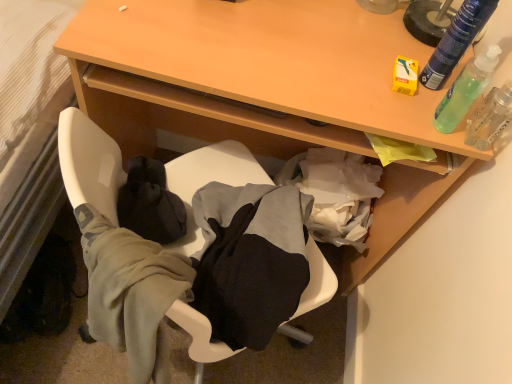
What do you see at coordinates (465, 90) in the screenshot? I see `green translucent bottle at upper right, the 2th bottle in the top-to-bottom sequence` at bounding box center [465, 90].

What is the approximate width of green translucent bottle at upper right, the 1th bottle positioned from the top?

green translucent bottle at upper right, the 1th bottle positioned from the top, is 4.90 centimeters wide.

Where is `green translucent bottle at upper right, the 2th bottle in the top-to-bottom sequence`? green translucent bottle at upper right, the 2th bottle in the top-to-bottom sequence is located at coordinates (465, 90).

Considering the relative sizes of green translucent bottle at upper right, the 1th bottle positioned from the top, and green translucent bottle at upper right, positioned as the 1th bottle in bottom-to-top order, in the image provided, is green translucent bottle at upper right, the 1th bottle positioned from the top, smaller than green translucent bottle at upper right, positioned as the 1th bottle in bottom-to-top order,?

Indeed, green translucent bottle at upper right, the 1th bottle positioned from the top, has a smaller size compared to green translucent bottle at upper right, positioned as the 1th bottle in bottom-to-top order.

From the image's perspective, between green translucent bottle at upper right, the 1th bottle positioned from the top, and green translucent bottle at upper right, positioned as the 1th bottle in bottom-to-top order, who is located below?

green translucent bottle at upper right, positioned as the 1th bottle in bottom-to-top order, appears lower in the image.

Is green translucent bottle at upper right, which appears as the 2th bottle when ordered from the bottom, thinner than green translucent bottle at upper right, the 2th bottle in the top-to-bottom sequence?

Yes, green translucent bottle at upper right, which appears as the 2th bottle when ordered from the bottom, is thinner than green translucent bottle at upper right, the 2th bottle in the top-to-bottom sequence.

From the picture: Is clear plastic spray bottle at upper right situated inside green translucent bottle at upper right, the 1th bottle positioned from the top, or outside?

The correct answer is: outside.

Can you see clear plastic spray bottle at upper right touching green translucent bottle at upper right, which appears as the 2th bottle when ordered from the bottom?

No, clear plastic spray bottle at upper right is not touching green translucent bottle at upper right, which appears as the 2th bottle when ordered from the bottom.

How different are the orientations of clear plastic spray bottle at upper right and green translucent bottle at upper right, which appears as the 2th bottle when ordered from the bottom, in degrees?

The angle between the facing direction of clear plastic spray bottle at upper right and the facing direction of green translucent bottle at upper right, which appears as the 2th bottle when ordered from the bottom, is 0.00131 degrees.

Which point is more distant from viewer, (490, 139) or (434, 65)?

The point (434, 65) is farther from the camera.

Could you tell me if clear plastic spray bottle at upper right is facing wooden table at upper center?

No, clear plastic spray bottle at upper right is not facing towards wooden table at upper center.

Which is more to the left, clear plastic spray bottle at upper right or wooden table at upper center?

From the viewer's perspective, wooden table at upper center appears more on the left side.

Measure the distance between clear plastic spray bottle at upper right and wooden table at upper center.

clear plastic spray bottle at upper right is 36.72 centimeters from wooden table at upper center.

Image resolution: width=512 pixels, height=384 pixels. What are the coordinates of `table behind the clear plastic spray bottle at upper right` in the screenshot? It's located at (269, 59).

Could you tell me if soft fabric chair at lower center is turned towards green translucent bottle at upper right, the 1th bottle positioned from the top?

No, soft fabric chair at lower center does not turn towards green translucent bottle at upper right, the 1th bottle positioned from the top.

Which is behind, point (316, 257) or point (441, 42)?

Point (316, 257)

Considering the positions of objects soft fabric chair at lower center and green translucent bottle at upper right, which appears as the 2th bottle when ordered from the bottom, in the image provided, who is behind, soft fabric chair at lower center or green translucent bottle at upper right, which appears as the 2th bottle when ordered from the bottom,?

soft fabric chair at lower center is further away from the camera.

Considering the sizes of objects soft fabric chair at lower center and green translucent bottle at upper right, the 1th bottle positioned from the top, in the image provided, who is thinner, soft fabric chair at lower center or green translucent bottle at upper right, the 1th bottle positioned from the top,?

green translucent bottle at upper right, the 1th bottle positioned from the top, is thinner.

Considering the sizes of clear plastic spray bottle at upper right and green translucent bottle at upper right, the 2th bottle in the top-to-bottom sequence, in the image, is clear plastic spray bottle at upper right wider or thinner than green translucent bottle at upper right, the 2th bottle in the top-to-bottom sequence,?

clear plastic spray bottle at upper right is thinner than green translucent bottle at upper right, the 2th bottle in the top-to-bottom sequence.

Which is nearer, (x=487, y=145) or (x=477, y=97)?

Positioned in front is point (x=477, y=97).

Locate an element on the screen. the 2nd bottle counting from the left of the clear plastic spray bottle at upper right is located at coordinates (465, 90).

From a real-world perspective, which object stands above the other?

clear plastic spray bottle at upper right, from a real-world perspective.

Is wooden table at upper center far from clear plastic spray bottle at upper right?

No.

In the scene shown: Is wooden table at upper center facing away from clear plastic spray bottle at upper right?

That's not correct — wooden table at upper center is not looking away from clear plastic spray bottle at upper right.

Is wooden table at upper center surrounding clear plastic spray bottle at upper right?

No, wooden table at upper center does not contain clear plastic spray bottle at upper right.

Where is `chair above the wooden table at upper center (from a real-world perspective)`? Image resolution: width=512 pixels, height=384 pixels. chair above the wooden table at upper center (from a real-world perspective) is located at coordinates (89, 163).

From a real-world perspective, is soft fabric chair at lower center physically located above or below wooden table at upper center?

In terms of real-world spatial position, soft fabric chair at lower center is above wooden table at upper center.

Is soft fabric chair at lower center completely or partially outside of wooden table at upper center?

soft fabric chair at lower center is positioned outside wooden table at upper center.

Is soft fabric chair at lower center facing away from wooden table at upper center?

No, soft fabric chair at lower center is not facing away from wooden table at upper center.

Identify the location of bottle that appears behind the green translucent bottle at upper right, positioned as the 1th bottle in bottom-to-top order. This screenshot has height=384, width=512. (456, 41).

From a real-world perspective, count 2nd bottles upward from the clear plastic spray bottle at upper right and point to it. Please provide its 2D coordinates.

[(456, 41)]

Looking at the image, which one is located further to clear plastic spray bottle at upper right, green translucent bottle at upper right, positioned as the 1th bottle in bottom-to-top order, or wooden table at upper center?

wooden table at upper center is positioned further to the anchor clear plastic spray bottle at upper right.

When comparing their distances from clear plastic spray bottle at upper right, does soft fabric chair at lower center or green translucent bottle at upper right, the 1th bottle positioned from the top, seem closer?

green translucent bottle at upper right, the 1th bottle positioned from the top.

When comparing their distances from soft fabric chair at lower center, does green translucent bottle at upper right, positioned as the 1th bottle in bottom-to-top order, or green translucent bottle at upper right, which appears as the 2th bottle when ordered from the bottom, seem further?

green translucent bottle at upper right, which appears as the 2th bottle when ordered from the bottom, lies further to soft fabric chair at lower center than the other object.

Which object lies further to the anchor point soft fabric chair at lower center, clear plastic spray bottle at upper right or green translucent bottle at upper right, which appears as the 2th bottle when ordered from the bottom?

clear plastic spray bottle at upper right is further to soft fabric chair at lower center.

Looking at the image, which one is located closer to green translucent bottle at upper right, the 1th bottle positioned from the top, green translucent bottle at upper right, the 2th bottle in the top-to-bottom sequence, or soft fabric chair at lower center?

Among the two, green translucent bottle at upper right, the 2th bottle in the top-to-bottom sequence, is located nearer to green translucent bottle at upper right, the 1th bottle positioned from the top.

Looking at the image, which one is located further to wooden table at upper center, soft fabric chair at lower center or green translucent bottle at upper right, the 1th bottle positioned from the top?

green translucent bottle at upper right, the 1th bottle positioned from the top, lies further to wooden table at upper center than the other object.

Consider the image. When comparing their distances from soft fabric chair at lower center, does green translucent bottle at upper right, the 2th bottle in the top-to-bottom sequence, or wooden table at upper center seem closer?

wooden table at upper center lies closer to soft fabric chair at lower center than the other object.

Which object lies nearer to the anchor point green translucent bottle at upper right, the 2th bottle in the top-to-bottom sequence, clear plastic spray bottle at upper right or green translucent bottle at upper right, the 1th bottle positioned from the top?

Among the two, green translucent bottle at upper right, the 1th bottle positioned from the top, is located nearer to green translucent bottle at upper right, the 2th bottle in the top-to-bottom sequence.

What are the coordinates of `table between soft fabric chair at lower center and green translucent bottle at upper right, the 1th bottle positioned from the top` in the screenshot? It's located at (269, 59).

You are a GUI agent. You are given a task and a screenshot of the screen. Output one action in this format:
    pyautogui.click(x=<x>, y=<y>)
    Task: Click on the table between soft fabric chair at lower center and clear plastic spray bottle at upper right
    
    Given the screenshot: What is the action you would take?
    click(x=269, y=59)

I want to click on bottle that lies between green translucent bottle at upper right, which appears as the 2th bottle when ordered from the bottom, and clear plastic spray bottle at upper right from top to bottom, so click(465, 90).

Locate an element on the screen. Image resolution: width=512 pixels, height=384 pixels. table between soft fabric chair at lower center and green translucent bottle at upper right, the 2th bottle in the top-to-bottom sequence is located at coordinates (269, 59).